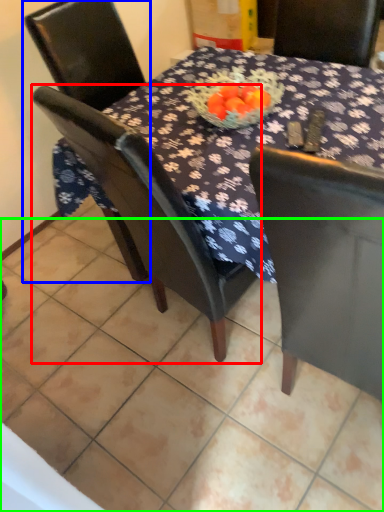
Question: Estimate the real-world distances between objects in this image. Which object is closer to chair (highlighted by a red box), chair (highlighted by a blue box) or tile (highlighted by a green box)?

Choices:
 (A) chair
 (B) tile

Answer: (B)